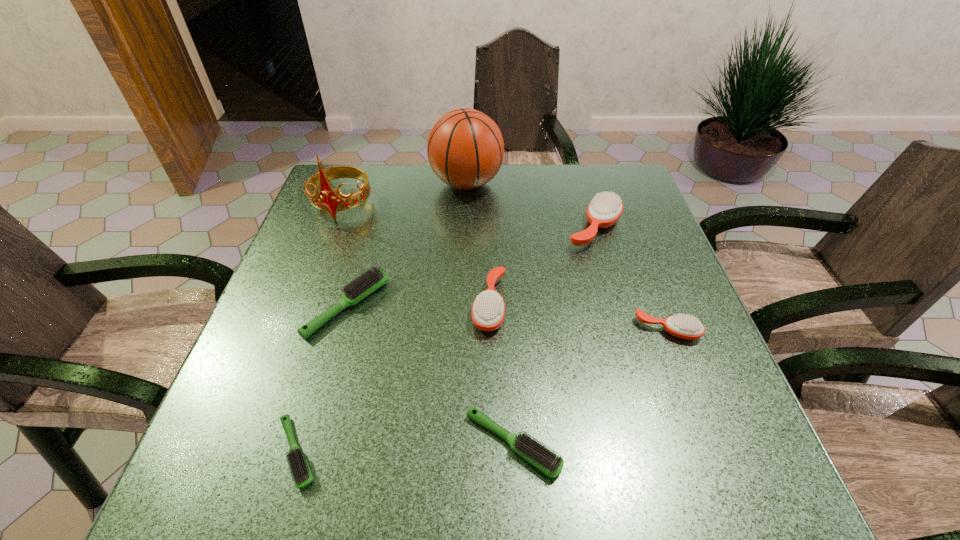
Locate an element on the screen. the smallest light hairbrush is located at coordinates (302, 476).

Where is `the shortest hairbrush`? the shortest hairbrush is located at coordinates (302, 476).

Locate an element on the screen. This screenshot has height=540, width=960. vacant region located 0.300m on the left of the basketball is located at coordinates (328, 184).

What are the coordinates of `free location located 0.170m on the front-facing side of the red tiara` in the screenshot? It's located at (318, 271).

Where is `free spot located 0.250m on the front of the biggest orange hairbrush`? The width and height of the screenshot is (960, 540). free spot located 0.250m on the front of the biggest orange hairbrush is located at coordinates (625, 333).

Locate an element on the screen. The image size is (960, 540). vacant space located 0.190m on the front of the second smallest orange hairbrush is located at coordinates (492, 425).

Image resolution: width=960 pixels, height=540 pixels. Identify the location of free space located on the back of the farthest light hairbrush. (374, 209).

In order to click on free space located on the back of the smallest orange hairbrush in this screenshot , I will do `click(624, 214)`.

Where is `free space located on the left of the rightmost light hairbrush`? free space located on the left of the rightmost light hairbrush is located at coordinates (288, 443).

The image size is (960, 540). I want to click on free space located 0.320m on the back of the smallest light hairbrush, so click(x=346, y=287).